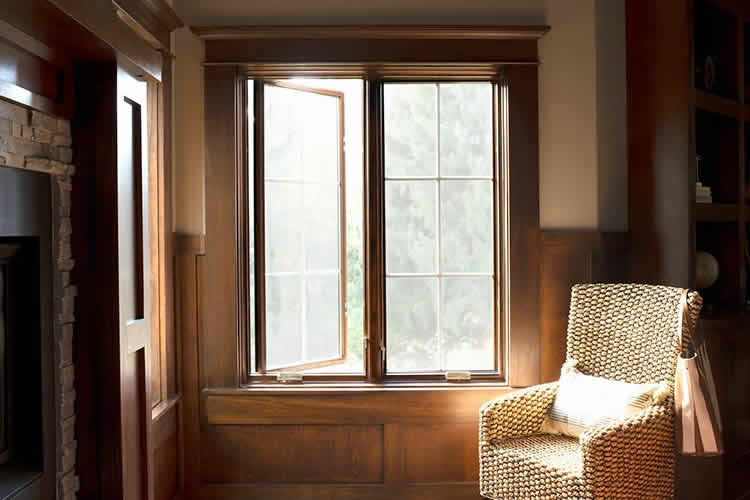
Identify the location of open window. (288, 250).